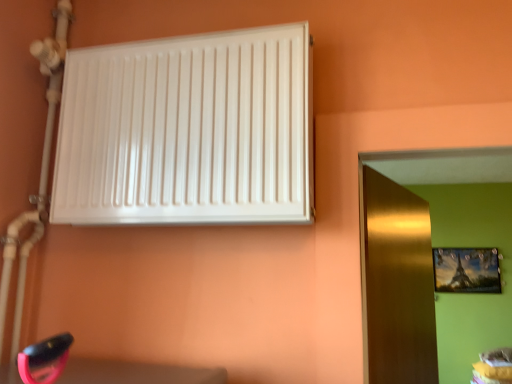
What do you see at coordinates (466, 270) in the screenshot? I see `metallic gold picture frame at upper right` at bounding box center [466, 270].

The height and width of the screenshot is (384, 512). I want to click on metallic gold picture frame at upper right, so click(x=466, y=270).

The width and height of the screenshot is (512, 384). What do you see at coordinates (188, 131) in the screenshot?
I see `white glossy radiator at upper left` at bounding box center [188, 131].

Measure the distance between point (368, 346) and camera.

Point (368, 346) is 3.76 feet from camera.

Where is `metallic gold picture frame at upper right`? metallic gold picture frame at upper right is located at coordinates (466, 270).

I want to click on radiator located in front of the metallic gold picture frame at upper right, so click(188, 131).

Is metallic gold picture frame at upper right to the left of white glossy radiator at upper left from the viewer's perspective?

In fact, metallic gold picture frame at upper right is to the right of white glossy radiator at upper left.

Is metallic gold picture frame at upper right facing away from white glossy radiator at upper left?

No.

In terms of height, does metallic gold picture frame at upper right look taller or shorter compared to white glossy radiator at upper left?

metallic gold picture frame at upper right is taller than white glossy radiator at upper left.

Based on the photo, from the image's perspective, which is below, gold metallic door at right or metallic gold picture frame at upper right?

metallic gold picture frame at upper right.

Which is in front, point (384, 186) or point (448, 286)?

Point (384, 186)

Is gold metallic door at right aimed at metallic gold picture frame at upper right?

No, gold metallic door at right is not aimed at metallic gold picture frame at upper right.

Is gold metallic door at right shorter than white glossy radiator at upper left?

Incorrect, the height of gold metallic door at right does not fall short of that of white glossy radiator at upper left.

Can white glossy radiator at upper left be found inside gold metallic door at right?

Actually, white glossy radiator at upper left is outside gold metallic door at right.

Which is in front, gold metallic door at right or white glossy radiator at upper left?

white glossy radiator at upper left is more forward.

The image size is (512, 384). Identify the location of radiator located in front of the gold metallic door at right. (188, 131).

Consider the image. Which of these two, white glossy radiator at upper left or gold metallic door at right, is wider?

With larger width is white glossy radiator at upper left.

Considering the relative positions of white glossy radiator at upper left and gold metallic door at right in the image provided, is white glossy radiator at upper left in front of gold metallic door at right?

Yes, the depth of white glossy radiator at upper left is less than that of gold metallic door at right.

Which of these two, white glossy radiator at upper left or gold metallic door at right, stands taller?

Standing taller between the two is gold metallic door at right.

Between white glossy radiator at upper left and metallic gold picture frame at upper right, which one has larger size?

With larger size is white glossy radiator at upper left.

Considering the sizes of objects white glossy radiator at upper left and metallic gold picture frame at upper right in the image provided, who is shorter, white glossy radiator at upper left or metallic gold picture frame at upper right?

white glossy radiator at upper left.

Would you say white glossy radiator at upper left is outside metallic gold picture frame at upper right?

white glossy radiator at upper left is positioned outside metallic gold picture frame at upper right.

Considering the sizes of white glossy radiator at upper left and metallic gold picture frame at upper right in the image, is white glossy radiator at upper left wider or thinner than metallic gold picture frame at upper right?

In the image, white glossy radiator at upper left appears to be wider than metallic gold picture frame at upper right.

From a real-world perspective, who is located lower, metallic gold picture frame at upper right or gold metallic door at right?

gold metallic door at right, from a real-world perspective.

Looking at this image, can you tell me how much metallic gold picture frame at upper right and gold metallic door at right differ in facing direction?

The facing directions of metallic gold picture frame at upper right and gold metallic door at right are 69.2 degrees apart.

Does metallic gold picture frame at upper right have a larger size compared to gold metallic door at right?

No, metallic gold picture frame at upper right is not bigger than gold metallic door at right.

Is metallic gold picture frame at upper right located outside gold metallic door at right?

metallic gold picture frame at upper right lies outside gold metallic door at right's area.

Image resolution: width=512 pixels, height=384 pixels. In the image, there is a metallic gold picture frame at upper right. In order to click on radiator above it (from the image's perspective) in this screenshot , I will do `click(188, 131)`.

Where is `picture frame on the right of gold metallic door at right`? This screenshot has height=384, width=512. picture frame on the right of gold metallic door at right is located at coordinates (466, 270).

Estimate the real-world distances between objects in this image. Which object is further from gold metallic door at right, white glossy radiator at upper left or metallic gold picture frame at upper right?

The object further to gold metallic door at right is metallic gold picture frame at upper right.

Looking at the image, which one is located closer to metallic gold picture frame at upper right, white glossy radiator at upper left or gold metallic door at right?

Based on the image, gold metallic door at right appears to be nearer to metallic gold picture frame at upper right.

Estimate the real-world distances between objects in this image. Which object is closer to white glossy radiator at upper left, gold metallic door at right or metallic gold picture frame at upper right?

Among the two, gold metallic door at right is located nearer to white glossy radiator at upper left.

Estimate the real-world distances between objects in this image. Which object is further from gold metallic door at right, metallic gold picture frame at upper right or white glossy radiator at upper left?

metallic gold picture frame at upper right is positioned further to the anchor gold metallic door at right.

Which object lies nearer to the anchor point white glossy radiator at upper left, metallic gold picture frame at upper right or gold metallic door at right?

gold metallic door at right is positioned closer to the anchor white glossy radiator at upper left.

From the image, which object appears to be farther from metallic gold picture frame at upper right, gold metallic door at right or white glossy radiator at upper left?

white glossy radiator at upper left lies further to metallic gold picture frame at upper right than the other object.

The height and width of the screenshot is (384, 512). In order to click on door positioned between white glossy radiator at upper left and metallic gold picture frame at upper right from near to far in this screenshot , I will do `click(396, 283)`.